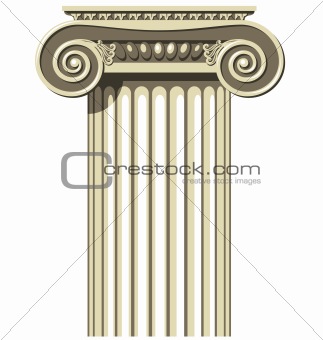
Find the location of a particular element. white vertical lines on column is located at coordinates (212, 320), (196, 323), (179, 320), (161, 325), (144, 323), (126, 320), (112, 325).